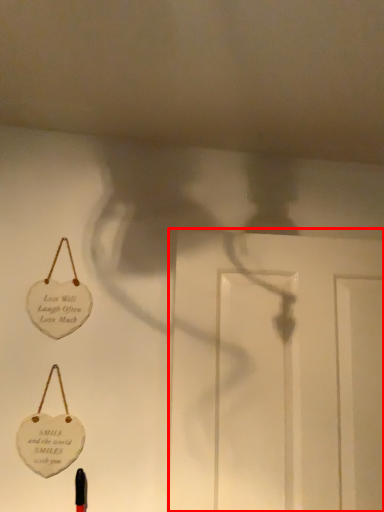
Question: From the image's perspective, what is the correct spatial positioning of door (annotated by the red box) in reference to badge?

Choices:
 (A) below
 (B) above

Answer: (A)